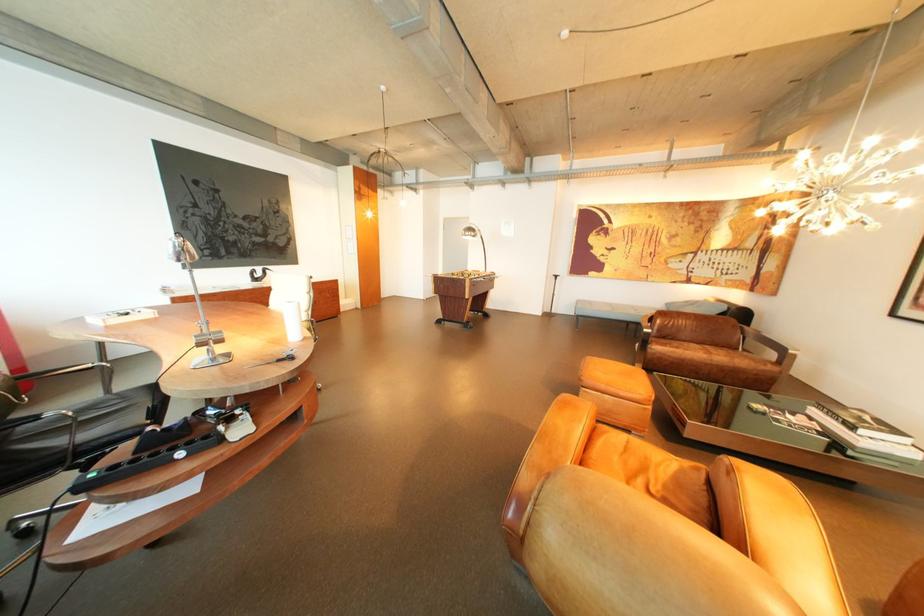
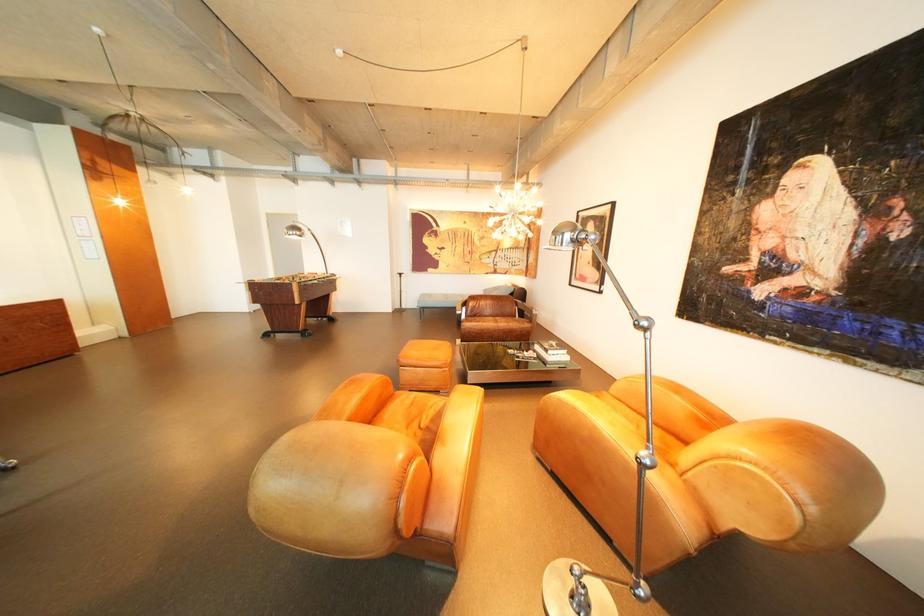
In the second image, find the point that corresponds to [639,448] in the first image.

(426, 403)